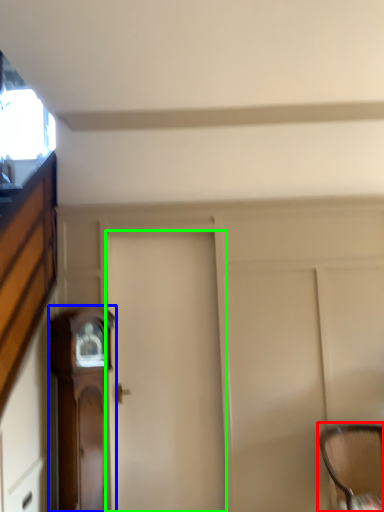
Question: Based on their relative distances, which object is farther from chair (highlighted by a red box)? Choose from furniture (highlighted by a blue box) and door (highlighted by a green box).

Choices:
 (A) furniture
 (B) door

Answer: (A)